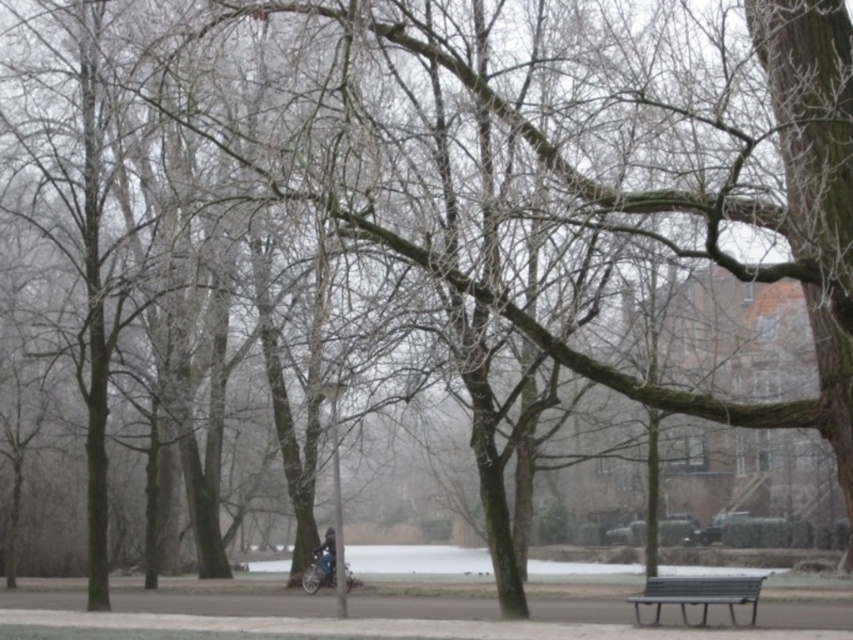
You are standing at the center of the paved path in the winter scene. You want to sit on the metallic gray bench at lower right. Which direction should you walk to reach it?

The metallic gray bench at lower right is located at coordinates 0.928 on the x axis and 0.819 on the y axis, so you should walk towards the lower right direction to reach it.

You are a photographer planning to take a picture of the dark blue jacket at center and the metallic gray bench at lower right. To ensure both are in focus, you need to know their heights. Which object is taller?

The metallic gray bench at lower right is taller than the dark blue jacket at center.

You are standing on the paved path in the winter scene and want to place a 1.2 meter long object between the metallic gray bench at lower right and the dark blue jacket at center. Is there enough space between them to fit the object?

The distance between the metallic gray bench at lower right and the dark blue jacket at center is 10.51 meters. Since the object is only 1.2 meters long, there is more than enough space to place it between them.